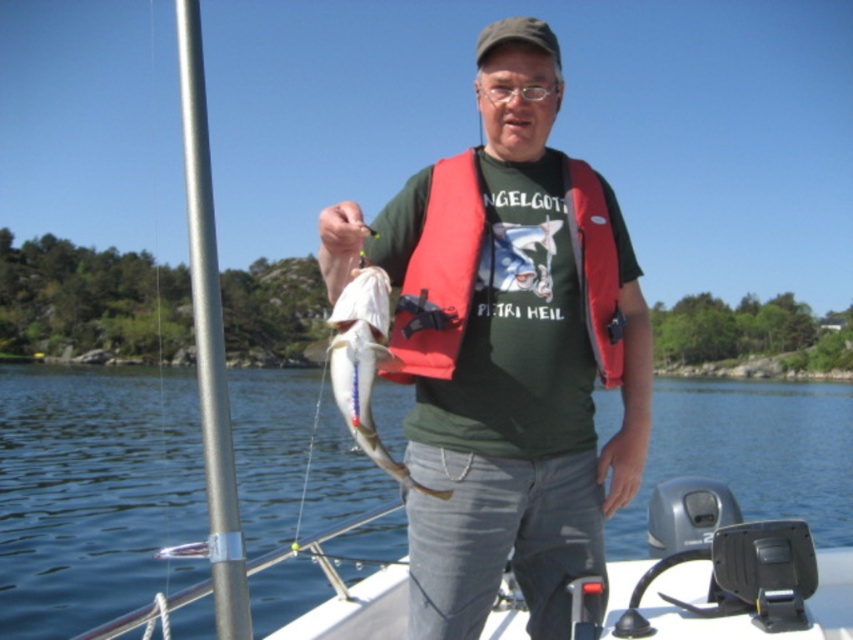
Please provide the coordinates of the matte green t shirt at center in the image. The coordinates should be in the format of a point with two decimal places, such as point (508, 348). The answer should be the exact coordinates provided in the Objects Description.

The coordinates of the matte green t shirt at center are point (508, 348).